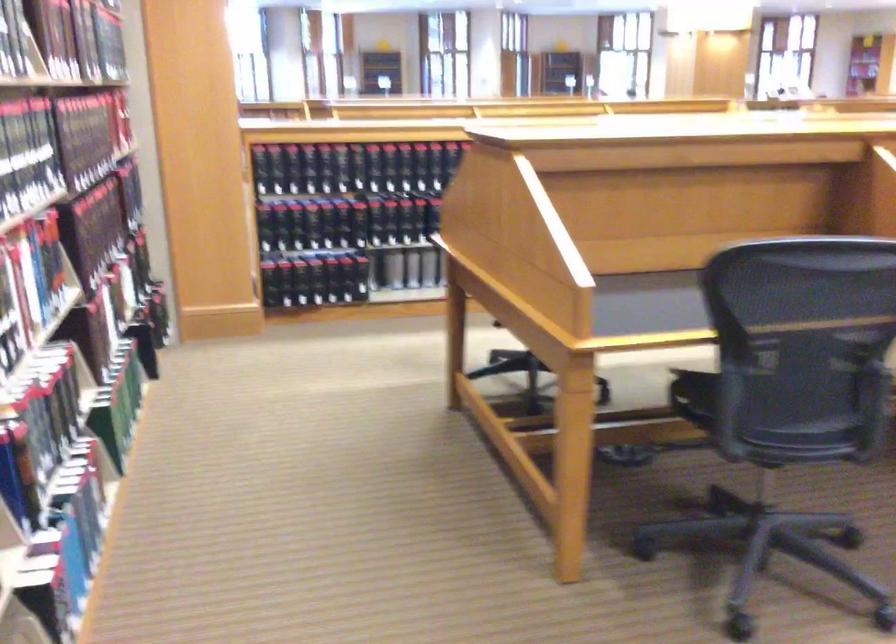
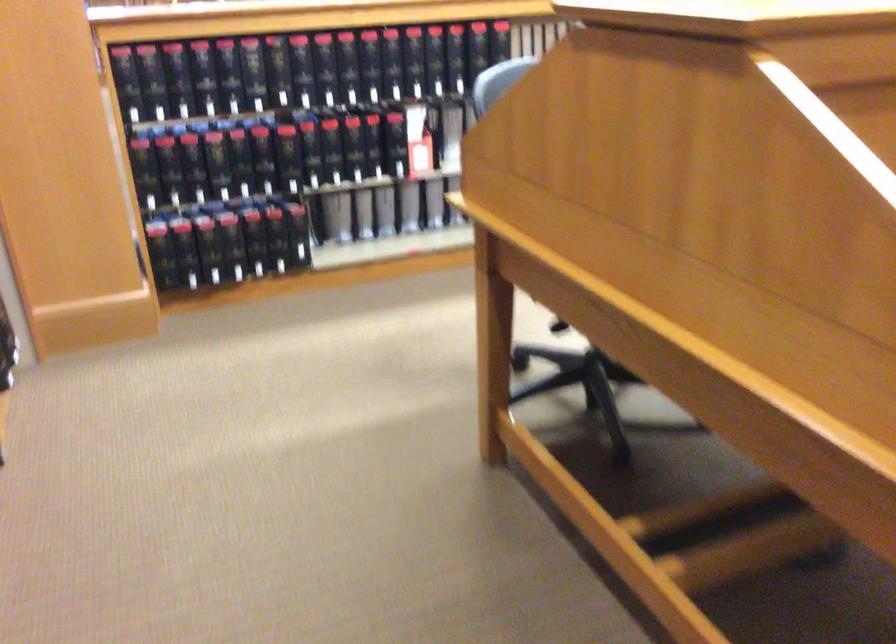
In the second image, find the point that corresponds to pixel 271 218 in the first image.

(161, 167)